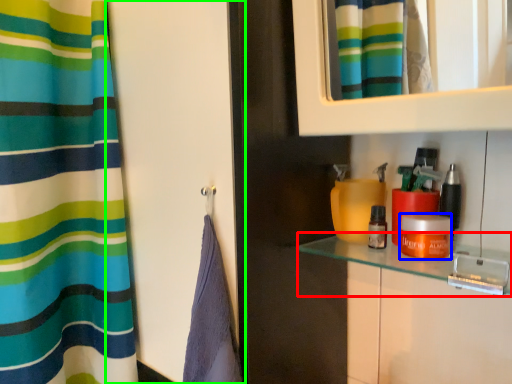
Question: Which object is positioned farthest from counter top (highlighted by a red box)? Select from cosmetic (highlighted by a blue box) and screen door (highlighted by a green box).

Choices:
 (A) cosmetic
 (B) screen door

Answer: (B)